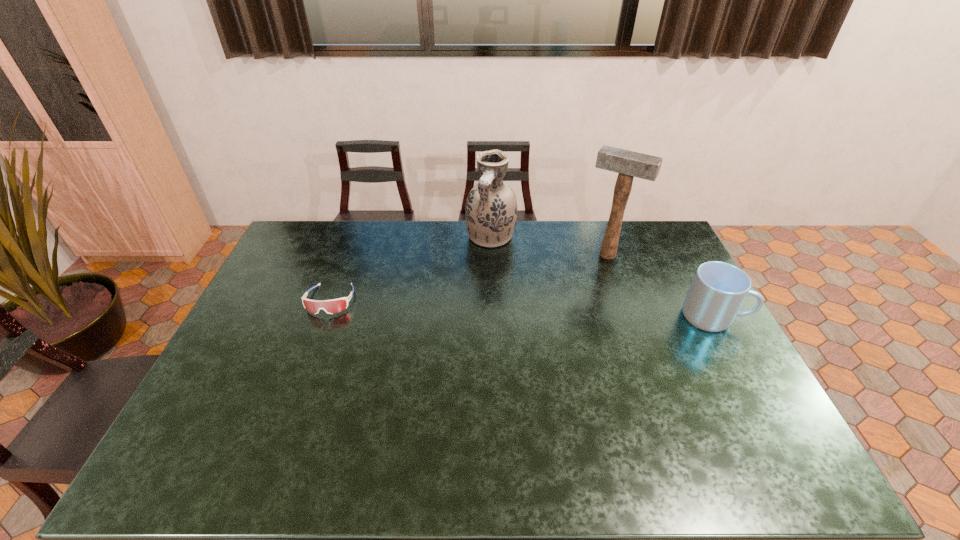
Locate an element on the screen. Image resolution: width=960 pixels, height=540 pixels. blank area located on the striking surface of the mallet is located at coordinates (583, 292).

This screenshot has height=540, width=960. Identify the location of free point located on the striking surface of the mallet. (585, 288).

The image size is (960, 540). Find the location of `vacant space situated 0.060m with the handle on the side of the third object from right to left`. vacant space situated 0.060m with the handle on the side of the third object from right to left is located at coordinates (481, 264).

Where is `blank space located 0.230m with the handle on the side of the third object from right to left`? blank space located 0.230m with the handle on the side of the third object from right to left is located at coordinates (469, 296).

What are the coordinates of `free region located with the handle on the side of the third object from right to left` in the screenshot? It's located at (476, 276).

The width and height of the screenshot is (960, 540). I want to click on mallet present at the far edge, so pyautogui.click(x=628, y=164).

You are a GUI agent. You are given a task and a screenshot of the screen. Output one action in this format:
    pyautogui.click(x=<x>, y=<y>)
    Task: Click on the vase present at the far edge
    
    Given the screenshot: What is the action you would take?
    pyautogui.click(x=491, y=210)

Identify the location of object positioned at the right edge. click(718, 289).

Locate an element on the screen. The height and width of the screenshot is (540, 960). vacant region at the far edge is located at coordinates (424, 231).

In the image, there is a desktop. Where is `vacant space at the near edge`? The height and width of the screenshot is (540, 960). vacant space at the near edge is located at coordinates (311, 408).